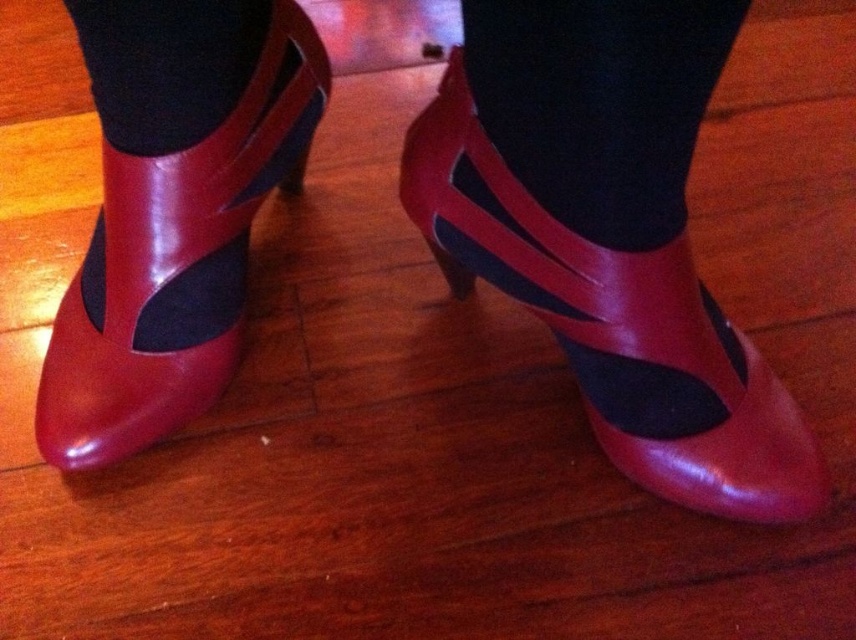
Question: Which object is closer to the camera taking this photo?

Choices:
 (A) black matte sock at center
 (B) shiny red leather shoe at center
 (C) black smooth sock at upper left
 (D) shiny leather boot at left

Answer: (A)

Question: Is shiny leather boot at left above black matte sock at center?

Choices:
 (A) no
 (B) yes

Answer: (A)

Question: Which object is closer to the camera taking this photo?

Choices:
 (A) black smooth sock at upper left
 (B) shiny red leather shoe at center
 (C) black matte sock at center

Answer: (C)

Question: Which object appears closest to the camera in this image?

Choices:
 (A) black matte sock at center
 (B) black smooth sock at upper left
 (C) shiny leather boot at left

Answer: (A)

Question: Does shiny red leather shoe at center come behind black matte sock at center?

Choices:
 (A) yes
 (B) no

Answer: (A)

Question: Observing the image, what is the correct spatial positioning of shiny red leather shoe at center in reference to black matte sock at center?

Choices:
 (A) below
 (B) above

Answer: (A)